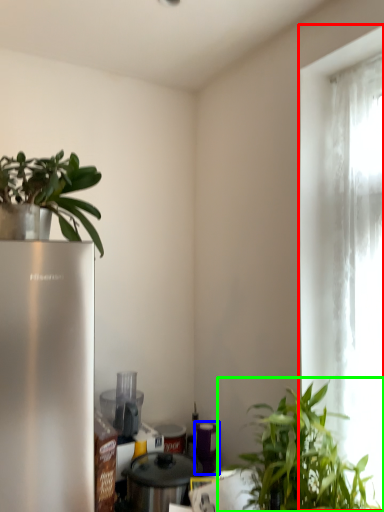
Question: Estimate the real-world distances between objects in this image. Which object is farther from window (highlighted by a red box), appliance (highlighted by a blue box) or houseplant (highlighted by a green box)?

Choices:
 (A) appliance
 (B) houseplant

Answer: (A)